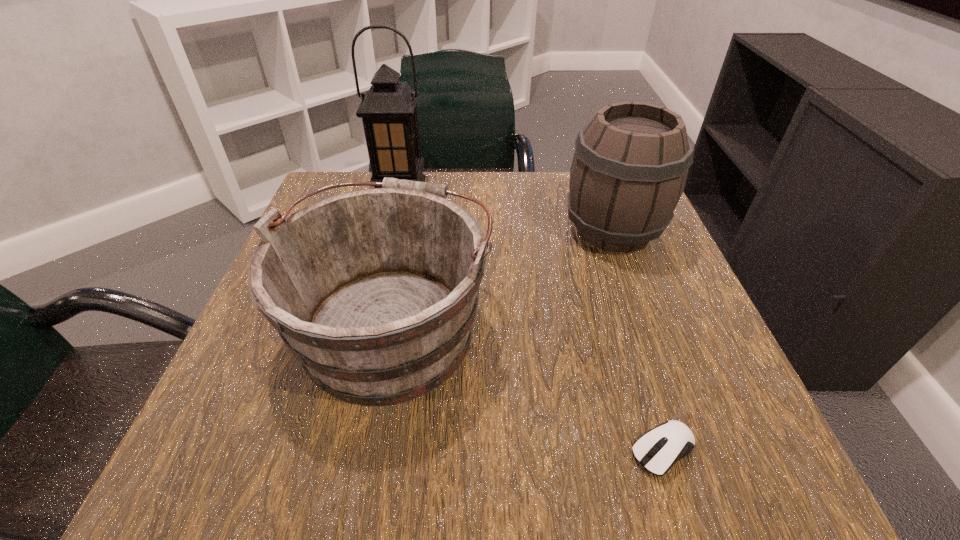
The width and height of the screenshot is (960, 540). I want to click on vacant region located on the right of the third tallest object, so click(x=539, y=324).

Locate an element on the screen. This screenshot has width=960, height=540. free region located 0.300m on the back of the shortest object is located at coordinates (609, 276).

Identify the location of lantern at the far edge. This screenshot has width=960, height=540. point(388,110).

Identify the location of wine bucket at the far edge. Image resolution: width=960 pixels, height=540 pixels. point(629,169).

Where is `wine bucket present at the near edge`? wine bucket present at the near edge is located at coordinates (375, 291).

Where is `mouse that is at the near edge`? The height and width of the screenshot is (540, 960). mouse that is at the near edge is located at coordinates (657, 450).

Locate an element on the screen. This screenshot has height=540, width=960. lantern present at the left edge is located at coordinates (388, 110).

Identify the location of wine bucket at the left edge. Image resolution: width=960 pixels, height=540 pixels. (375, 291).

Find the location of a particular element. The width and height of the screenshot is (960, 540). wine bucket that is at the right edge is located at coordinates (629, 169).

This screenshot has width=960, height=540. What are the coordinates of `mouse at the right edge` in the screenshot? It's located at (657, 450).